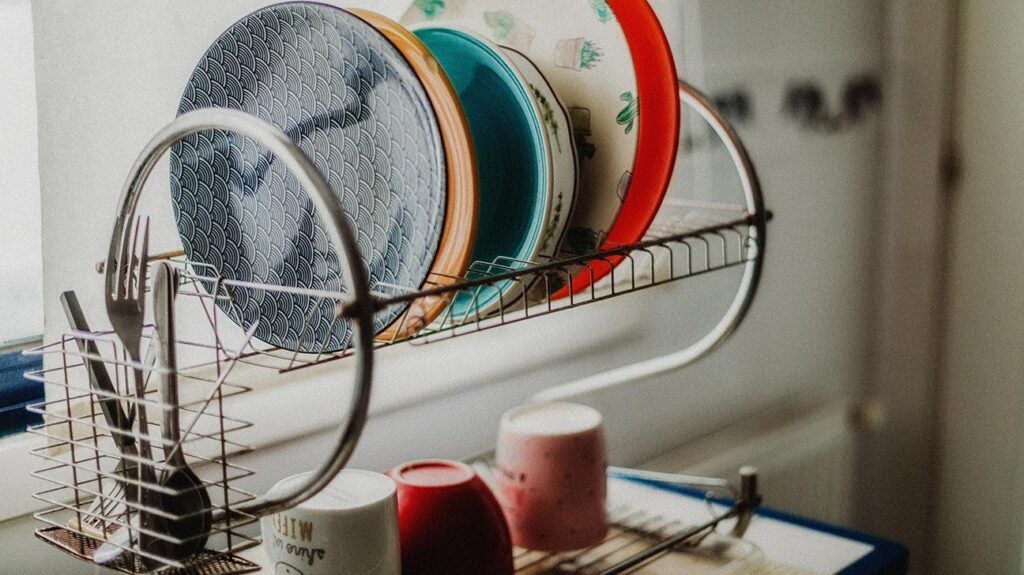
Identify the location of plate on rack. (420, 143), (457, 166), (508, 132), (553, 128), (612, 110), (663, 106).